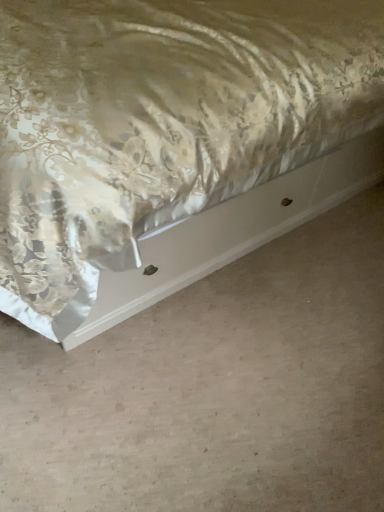
The width and height of the screenshot is (384, 512). What do you see at coordinates (159, 124) in the screenshot?
I see `gold satin bed at upper left` at bounding box center [159, 124].

At what (x,y) coordinates should I click in order to perform the action: click on gold satin bed at upper left. Please return your answer as a coordinate pair (x, y). Image resolution: width=384 pixels, height=512 pixels. Looking at the image, I should click on (159, 124).

The width and height of the screenshot is (384, 512). What are the coordinates of `gold satin bed at upper left` in the screenshot? It's located at [159, 124].